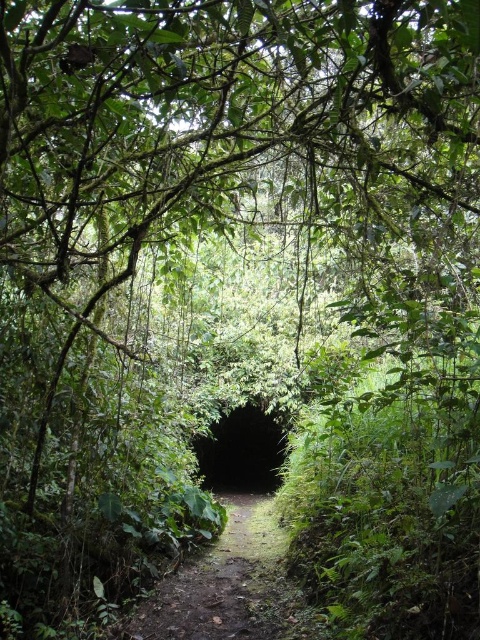
From the picture: You are a hiker walking along the narrow path towards the tunnel entrance. You notice two points marked on your map at coordinates point (x=259, y=608) and point (x=214, y=474). Which point should you reach first while moving forward?

You will reach point (x=259, y=608) first because it is in front of point (x=214, y=474) along your path towards the tunnel entrance.

You are an adventurer carrying a 2.5 meter long ladder. You are standing at the start of the dirt path at center and need to reach the black matte tunnel at center. Can you safely carry the ladder horizontally through the path without hitting the surrounding vegetation?

The dirt path at center is 6.74 meters away from the black matte tunnel at center. Since the ladder is 2.5 meters long, which is shorter than the distance between the path and the tunnel, you can safely carry it horizontally without hitting the vegetation.